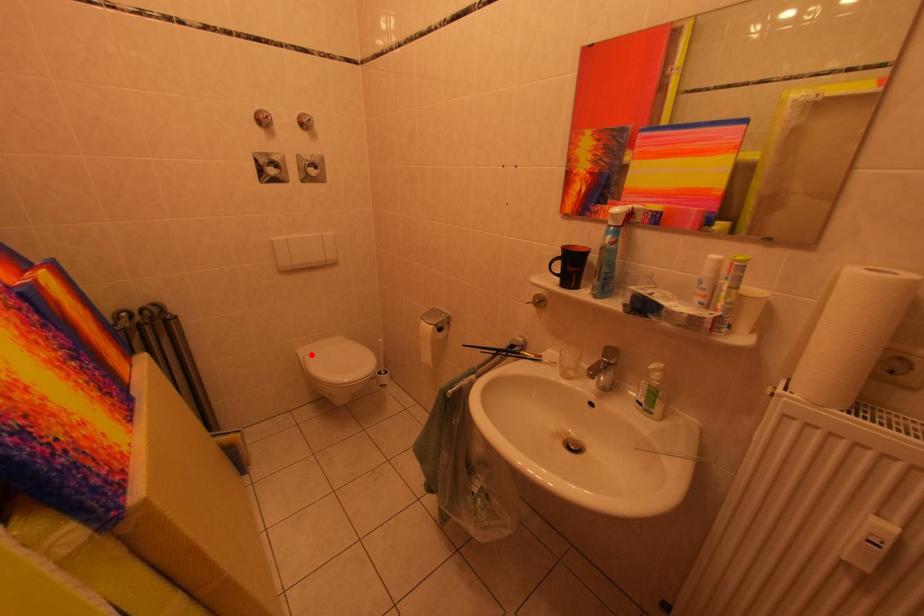
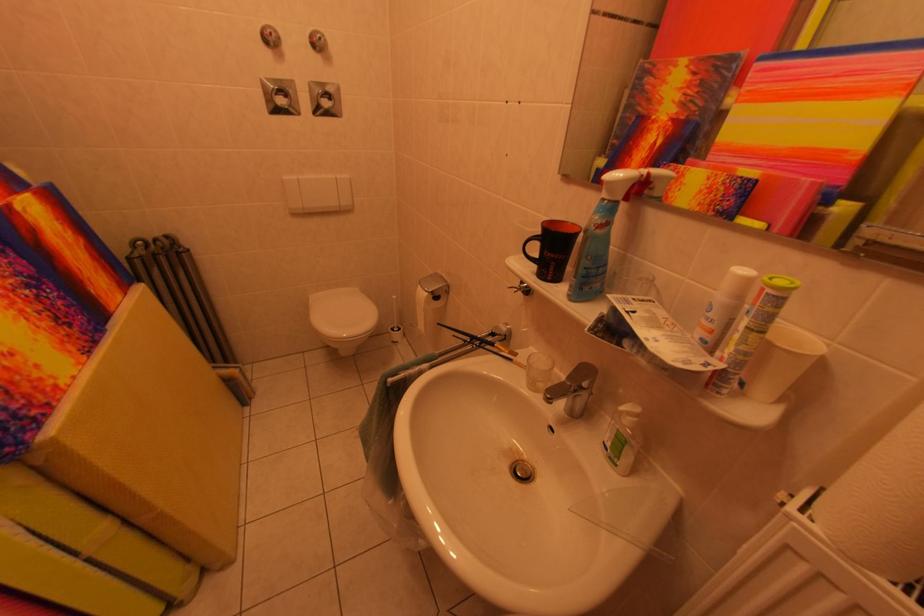
In the second image, find the point that corresponds to the highlighted location in the first image.

(322, 301)